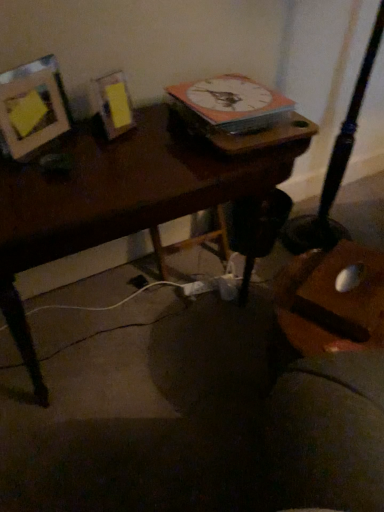
Question: Is white glossy clock at upper center bigger or smaller than wooden desk at center?

Choices:
 (A) small
 (B) big

Answer: (A)

Question: Is point (172, 92) positioned closer to the camera than point (150, 203)?

Choices:
 (A) closer
 (B) farther

Answer: (B)

Question: Which is nearer to the matte wood picture frame at upper left?

Choices:
 (A) white glossy clock at upper center
 (B) wooden desk at center

Answer: (B)

Question: Which object is the farthest from the white glossy clock at upper center?

Choices:
 (A) wooden desk at center
 (B) matte wood picture frame at upper left

Answer: (B)